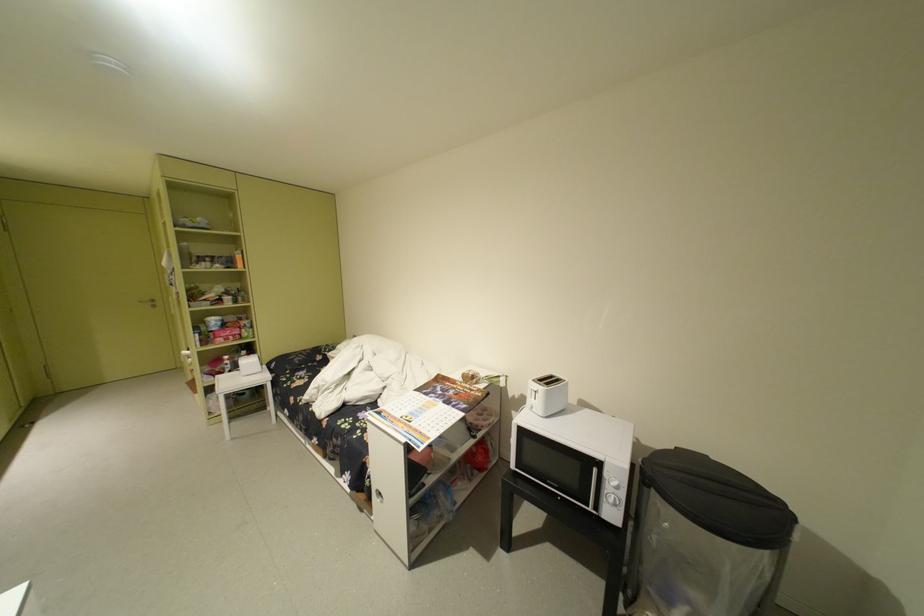
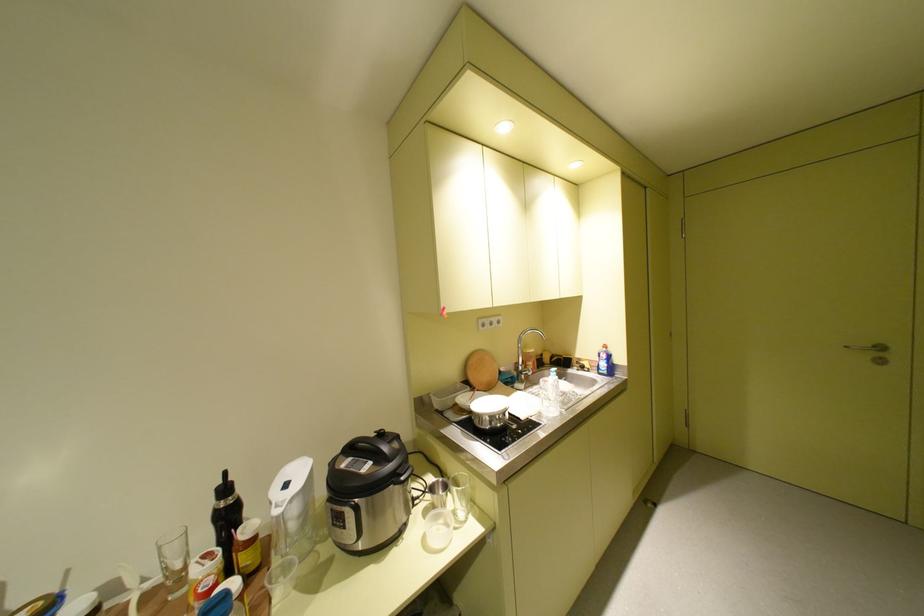
The point at (151,302) is marked in the first image. Where is the corresponding point in the second image?

(857, 347)